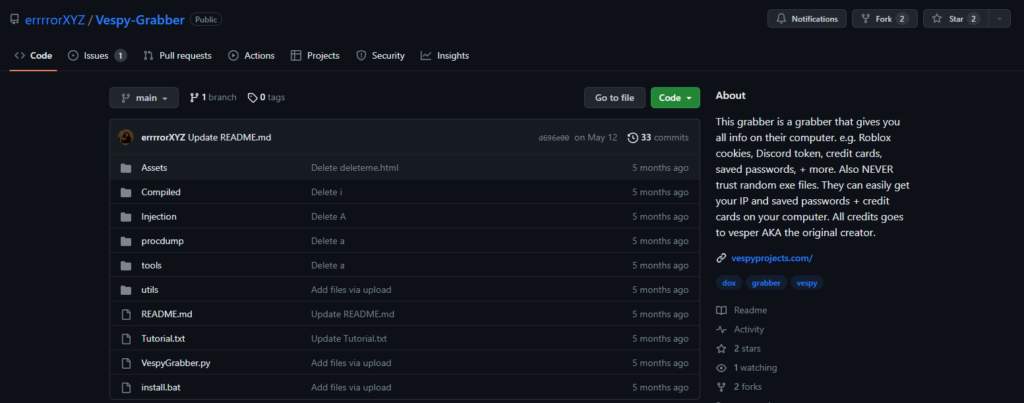
You are a GUI agent. You are given a task and a screenshot of the screen. Output one action in this format:
    pyautogui.click(x=<x>, y=<y>)
    Task: Click on the folders
    This screenshot has width=1024, height=403.
    Given the screenshot: What is the action you would take?
    pyautogui.click(x=125, y=168), pyautogui.click(x=125, y=198), pyautogui.click(x=128, y=217), pyautogui.click(x=122, y=235), pyautogui.click(x=128, y=260), pyautogui.click(x=124, y=283)